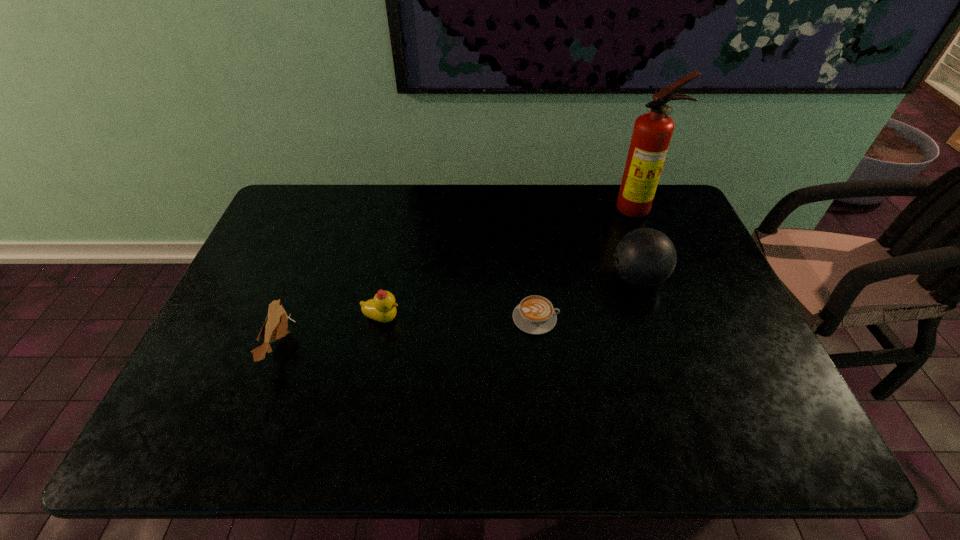
Locate an element on the screen. Image resolution: width=960 pixels, height=540 pixels. free space located on the grip area of the bowling ball is located at coordinates (494, 279).

Find the location of a particular element. The height and width of the screenshot is (540, 960). free space located on the grip area of the bowling ball is located at coordinates (522, 279).

The height and width of the screenshot is (540, 960). I want to click on free space located 0.390m on the front-facing side of the fourth object from right to left, so click(550, 318).

At what (x,y) coordinates should I click in order to perform the action: click on free location located 0.290m at the beak of the leftmost object. Please return your answer as a coordinate pair (x, y). This screenshot has width=960, height=540. Looking at the image, I should click on (406, 345).

At what (x,y) coordinates should I click in order to perform the action: click on vacant position located on the side of the cappuccino with the handle. Please return your answer as a coordinate pair (x, y). The height and width of the screenshot is (540, 960). Looking at the image, I should click on (653, 318).

At what (x,y) coordinates should I click in order to perform the action: click on object at the far edge. Please return your answer as a coordinate pair (x, y). The image size is (960, 540). Looking at the image, I should click on (652, 132).

The image size is (960, 540). In order to click on object located in the left edge section of the desktop in this screenshot , I will do `click(275, 327)`.

Where is `fire extinguisher that is at the right edge`? This screenshot has width=960, height=540. fire extinguisher that is at the right edge is located at coordinates (652, 132).

Find the location of `bowling ball that is at the right edge`. bowling ball that is at the right edge is located at coordinates (645, 257).

Find the location of a particular element. The width and height of the screenshot is (960, 540). object located at the far right corner is located at coordinates (652, 132).